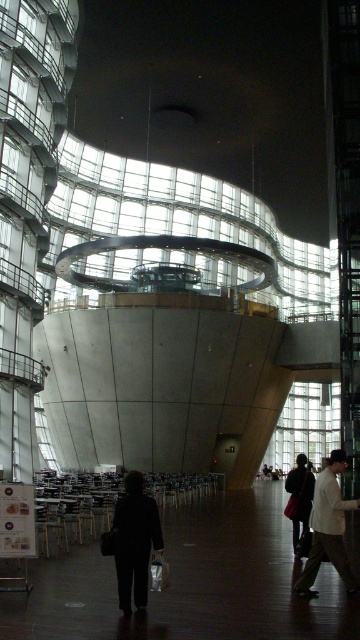
Does light beige jacket at lower right appear on the right side of matte black jacket at center?

In fact, light beige jacket at lower right is to the left of matte black jacket at center.

Does light beige jacket at lower right have a smaller size compared to matte black jacket at center?

Indeed, light beige jacket at lower right has a smaller size compared to matte black jacket at center.

Does point (327, 493) lie behind point (299, 516)?

No, it is in front of (299, 516).

I want to click on light beige jacket at lower right, so click(327, 528).

Between point (120, 588) and point (307, 500), which one is positioned behind?

Point (307, 500)

Can you confirm if dark matte coat at center is bigger than matte black jacket at center?

No, dark matte coat at center is not bigger than matte black jacket at center.

In the scene shown: Measure the distance between dark matte coat at center and camera.

A distance of 27.27 meters exists between dark matte coat at center and camera.

You are a GUI agent. You are given a task and a screenshot of the screen. Output one action in this format:
    pyautogui.click(x=<x>, y=<y>)
    Task: Click on the dark matte coat at center
    This screenshot has width=360, height=640.
    Given the screenshot: What is the action you would take?
    pyautogui.click(x=135, y=540)

Is dark matte coat at center wider than light beige jacket at lower right?

Incorrect, dark matte coat at center's width does not surpass light beige jacket at lower right's.

Which is more to the right, dark matte coat at center or light beige jacket at lower right?

Positioned to the right is light beige jacket at lower right.

Is point (127, 493) farther from viewer compared to point (336, 460)?

No, (127, 493) is in front of (336, 460).

This screenshot has width=360, height=640. Find the location of `dark matte coat at center`. dark matte coat at center is located at coordinates (135, 540).